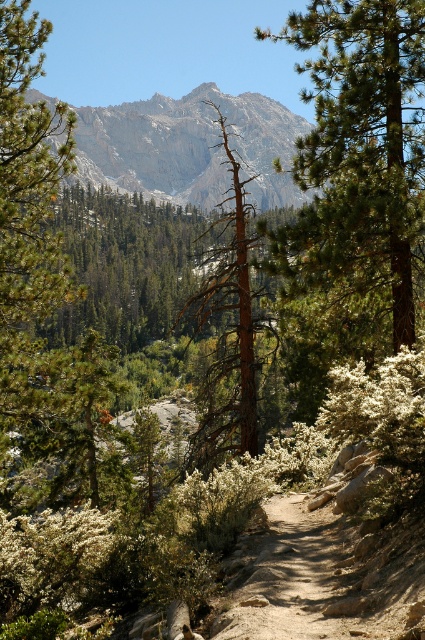
Does rugged granite mountain at center have a smaller size compared to brown rough bark tree at center?

No, rugged granite mountain at center is not smaller than brown rough bark tree at center.

Is point (261, 129) positioned in front of point (243, 246)?

That is False.

Which is in front, point (90, 125) or point (215, 440)?

Point (215, 440)

Find the location of a particular element. rugged granite mountain at center is located at coordinates (189, 147).

Which of these two, green needle-like at center or brown rough bark tree at center, stands shorter?

green needle-like at center

Measure the distance between green needle-like at center and brown rough bark tree at center.

green needle-like at center and brown rough bark tree at center are 121.41 feet apart.

Where is `green needle-like at center`? The image size is (425, 640). green needle-like at center is located at coordinates (360, 145).

This screenshot has height=640, width=425. What are the coordinates of `green needle-like at center` in the screenshot? It's located at (360, 145).

Can you confirm if green needle-like at center is positioned below rugged granite mountain at center?

Yes.

Who is shorter, green needle-like at center or rugged granite mountain at center?

Standing shorter between the two is green needle-like at center.

Is point (346, 163) closer to viewer compared to point (263, 193)?

Yes, point (346, 163) is closer to viewer.

Where is `green needle-like at center`? The width and height of the screenshot is (425, 640). green needle-like at center is located at coordinates (360, 145).